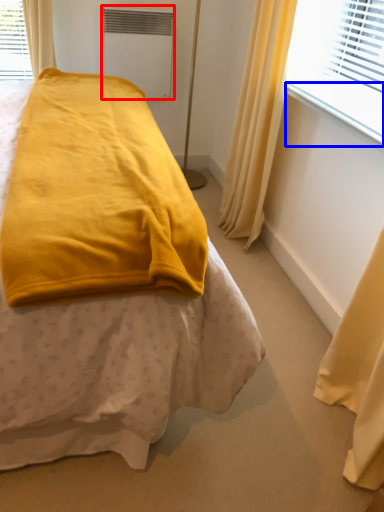
Question: Which object is closer to the camera taking this photo, air conditioning (highlighted by a red box) or window sill (highlighted by a blue box)?

Choices:
 (A) air conditioning
 (B) window sill

Answer: (B)